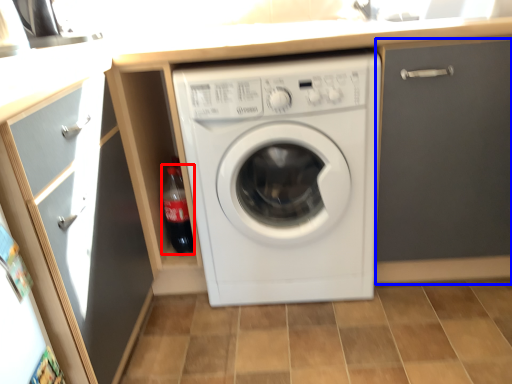
Question: Which object is closer to the camera taking this photo, bottle (highlighted by a red box) or door (highlighted by a blue box)?

Choices:
 (A) bottle
 (B) door

Answer: (B)